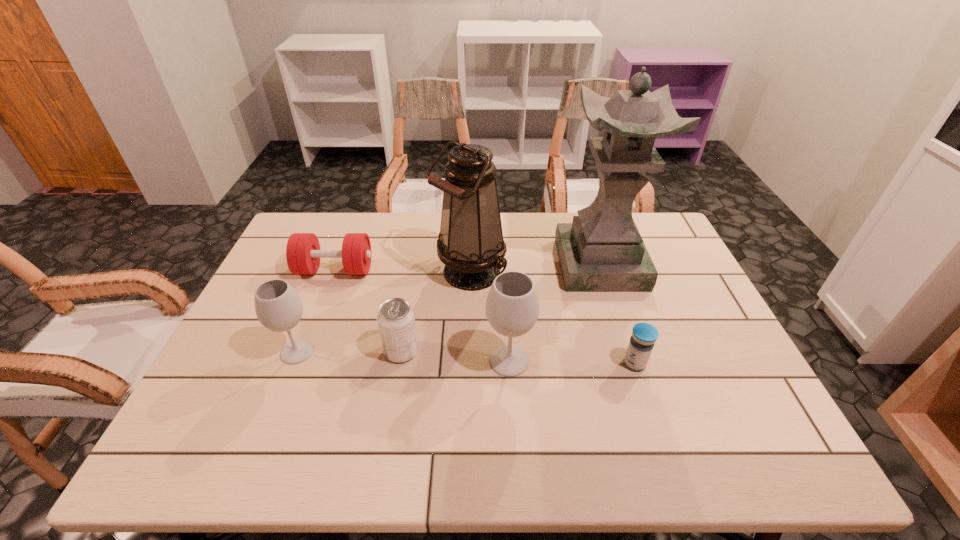
Identify the location of free space between the second tallest object and the medicine. (552, 318).

Locate an element on the screen. This screenshot has width=960, height=540. free space between the shorter wineglass and the medicine is located at coordinates (466, 357).

Image resolution: width=960 pixels, height=540 pixels. I want to click on vacant point located between the tallest object and the medicine, so (x=617, y=314).

This screenshot has height=540, width=960. Identify the location of free space that is in between the medicine and the dumbbell. (485, 316).

Where is `vacant area that lies between the right wineglass and the medicine`? The height and width of the screenshot is (540, 960). vacant area that lies between the right wineglass and the medicine is located at coordinates (572, 362).

You are a GUI agent. You are given a task and a screenshot of the screen. Output one action in this format:
    pyautogui.click(x=<x>, y=<y>)
    Task: Click on the empty location between the medicine and the tallest object
    This screenshot has width=960, height=540.
    Given the screenshot: What is the action you would take?
    pyautogui.click(x=617, y=314)

Locate an element on the screen. The image size is (960, 540). empty space that is in between the medicine and the shorter wineglass is located at coordinates (466, 357).

At what (x,y) coordinates should I click in order to perform the action: click on object that is the sixth closest to the medicine. Please return your answer as a coordinate pair (x, y). The width and height of the screenshot is (960, 540). Looking at the image, I should click on (278, 307).

Locate which object ranks fifth in proximity to the sculpture. Please provide its 2D coordinates. Your answer should be formatted as a tuple, i.e. [(x, y)], where the tuple contains the x and y coordinates of a point satisfying the conditions above.

[(303, 254)]

Locate an element on the screen. The width and height of the screenshot is (960, 540). vacant position in the image that satisfies the following two spatial constraints: 1. on the back side of the soda can; 2. on the left side of the shorter wineglass is located at coordinates (298, 351).